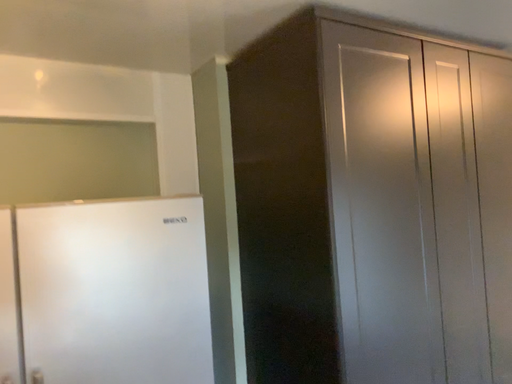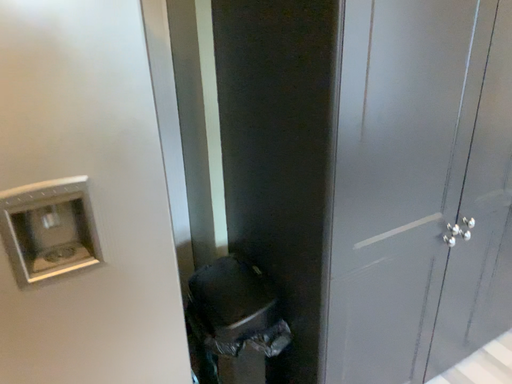
Question: How did the camera likely rotate when shooting the video?

Choices:
 (A) rotated downward
 (B) rotated upward

Answer: (A)